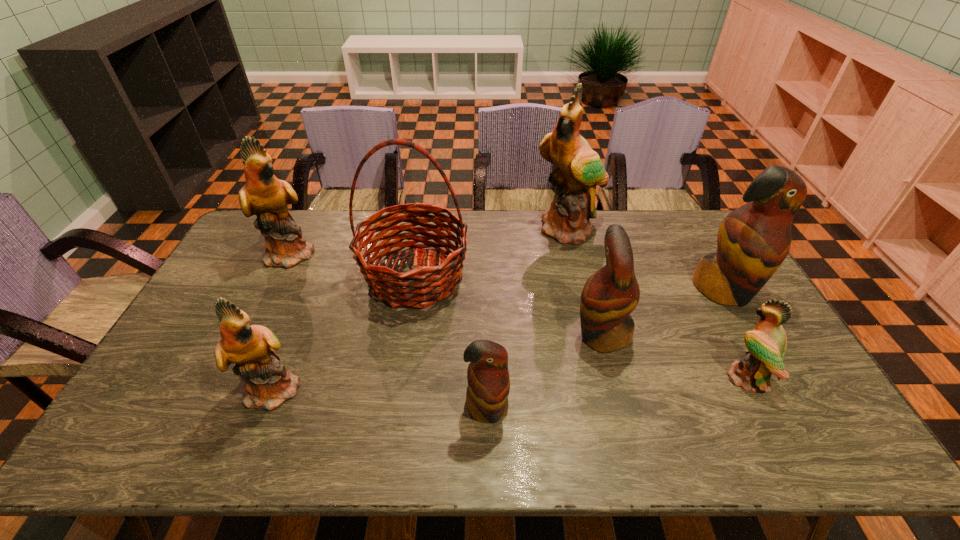
This screenshot has width=960, height=540. I want to click on vacant space situated on the front-facing side of the smallest green parrot, so click(649, 378).

You are a GUI agent. You are given a task and a screenshot of the screen. Output one action in this format:
    pyautogui.click(x=<x>, y=<y>)
    Task: Click on the vacant space situated 0.050m on the front-facing side of the smallest green parrot
    
    Given the screenshot: What is the action you would take?
    pyautogui.click(x=707, y=378)

The height and width of the screenshot is (540, 960). What are the coordinates of `free spot located on the front-facing side of the smallest green parrot` in the screenshot? It's located at (649, 378).

You are a GUI agent. You are given a task and a screenshot of the screen. Output one action in this format:
    pyautogui.click(x=<x>, y=<y>)
    Task: Click on the vacant space situated on the face of the nearest red parrot
    This screenshot has height=540, width=960.
    Given the screenshot: What is the action you would take?
    pyautogui.click(x=488, y=455)

The image size is (960, 540). What are the coordinates of `basket at the far edge` in the screenshot? It's located at (421, 287).

Identify the location of object located in the near edge section of the desktop. (488, 388).

You are a GUI agent. You are given a task and a screenshot of the screen. Output one action in this format:
    pyautogui.click(x=<x>, y=<y>)
    Task: Click on the object that is positioned at the left edge
    This screenshot has height=540, width=960.
    Given the screenshot: What is the action you would take?
    (264, 195)

Where is `object located at the far left corner`? The width and height of the screenshot is (960, 540). object located at the far left corner is located at coordinates (264, 195).

This screenshot has height=540, width=960. In the image, there is a desktop. What are the coordinates of `vacant space at the far edge` in the screenshot? It's located at (659, 234).

The image size is (960, 540). Find the location of `free region at the near edge of the desktop`. free region at the near edge of the desktop is located at coordinates (557, 445).